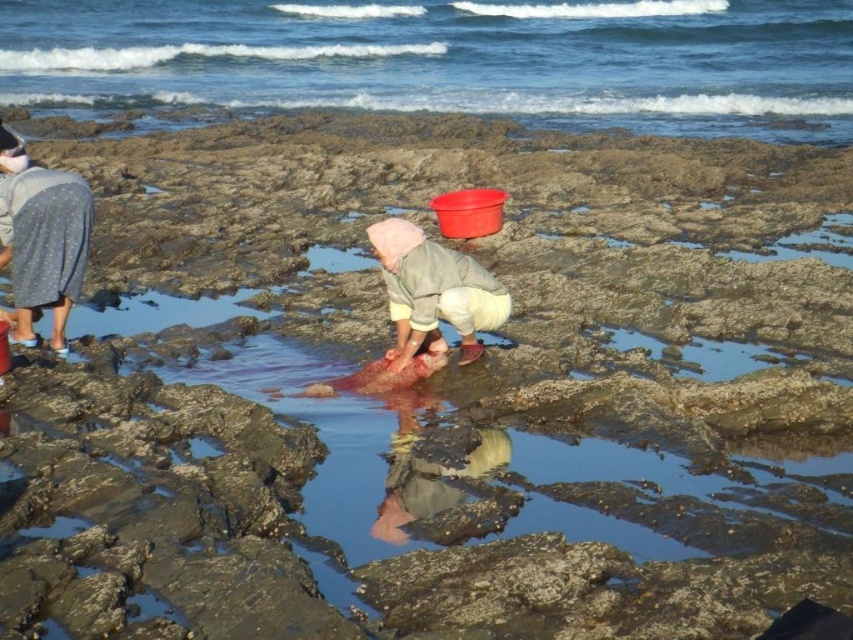
You are a photographer trying to capture the scene at the rocky shoreline. You notice the blue water at upper center and the pink fabric at center. Which object is higher in the image?

The blue water at upper center is taller than the pink fabric at center.

You are standing at the rocky shoreline and see the blue water at upper center and the pink fabric at center. Which object covers a wider area in the image?

The blue water at upper center has a larger width than the pink fabric at center, so it covers a wider area in the image.

You are a photographer trying to capture the entire scene of the rocky shoreline. You need to ensure both the blue water at upper center and the gray dotted skirt at upper left are fully visible in your shot. Based on their sizes, which object should you prioritize framing closer to the edge of the photo to avoid cropping?

The gray dotted skirt at upper left should be prioritized closer to the edge of the photo because its width is smaller than the blue water at upper center, making it easier to fit within the frame without cropping.